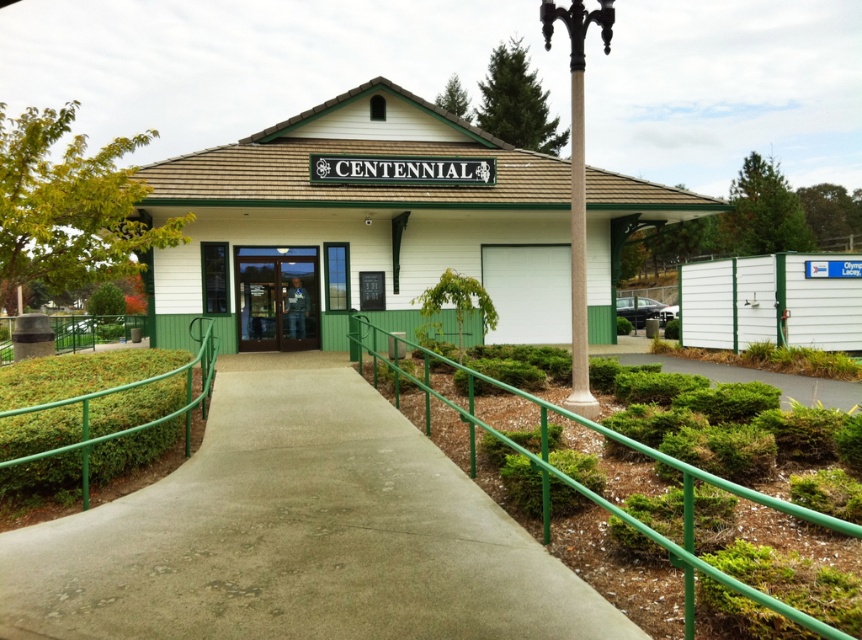
Question: Among these points, which one is farthest from the camera?

Choices:
 (A) (467, 488)
 (B) (253, 268)
 (C) (767, 634)

Answer: (B)

Question: Is green metal railing at center further to camera compared to transparent glass door at center?

Choices:
 (A) yes
 (B) no

Answer: (B)

Question: Which point is farther to the camera?

Choices:
 (A) transparent glass door at center
 (B) green metal railing at center
 (C) green metallic railing at center
 (D) concrete at center

Answer: (A)

Question: Can you confirm if concrete at center is positioned below transparent glass door at center?

Choices:
 (A) no
 (B) yes

Answer: (B)

Question: Which of these objects is positioned closest to the green metal railing at center?

Choices:
 (A) transparent glass door at center
 (B) concrete at center

Answer: (B)

Question: Does concrete at center appear under green metallic railing at center?

Choices:
 (A) no
 (B) yes

Answer: (B)